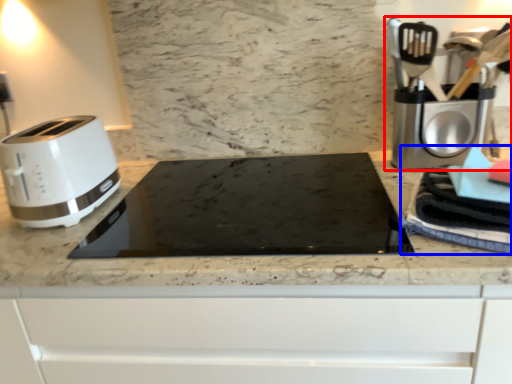
Question: Which of the following is the farthest to the observer, coffee machine (highlighted by a red box) or blanket (highlighted by a blue box)?

Choices:
 (A) coffee machine
 (B) blanket

Answer: (A)